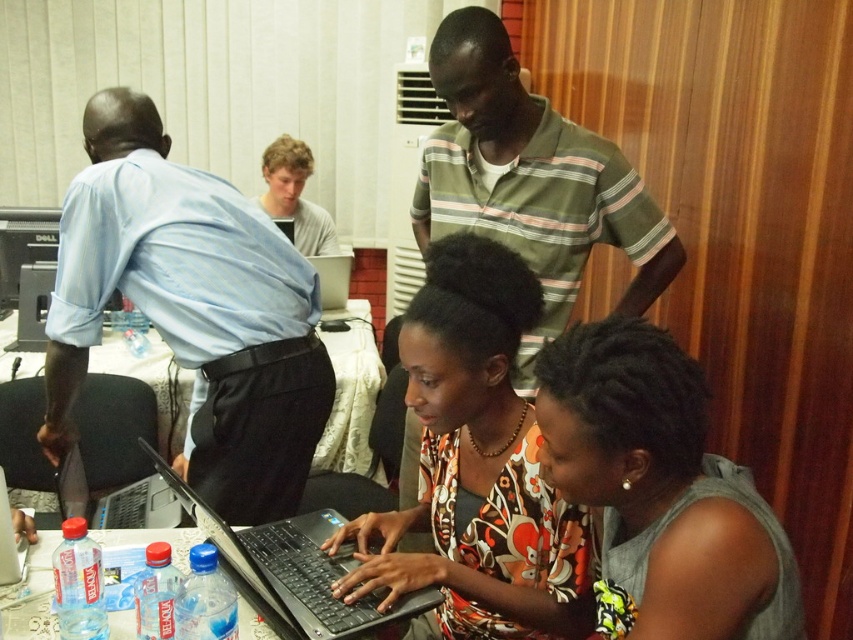
You are a photographer positioned at the entrance of the room. You want to take a photo of the silver metallic laptop at center without the floral print shirt at center blocking the view. Is the laptop currently visible from your position?

The floral print shirt at center is closer to the viewer than the silver metallic laptop at center, so the laptop may be partially or fully blocked by the shirt from your position.

Looking at this image, you are a photographer trying to capture a candid shot of the man in the green striped shirt at upper center and the person with light brown hair at upper center. Since you want to ensure both are in focus, you need to know their relative positions. Which one is closer to the camera?

The green striped shirt at upper center is positioned under light brown hair at upper center, meaning the light brown hair at upper center is closer to the camera than the green striped shirt at upper center.

You are a photographer trying to capture a candid shot of the man in the green striped shirt at upper center without blocking the view of the silver metallic laptop at lower left. Is there a way to position yourself so that both are visible in the frame?

The green striped shirt at upper center is positioned over the silver metallic laptop at lower left, so if you position yourself below the man, you can see both the green striped shirt at upper center and the silver metallic laptop at lower left in the frame.